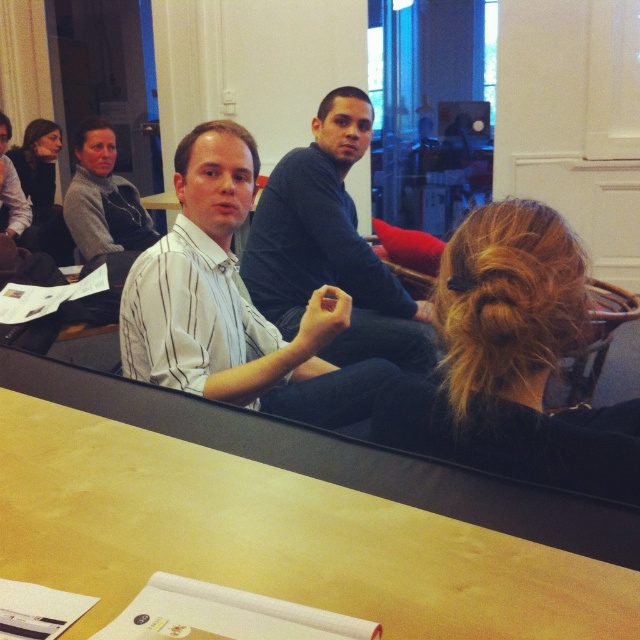
Looking at this image, does wooden table at lower center appear over white striped shirt at left?

No, wooden table at lower center is not above white striped shirt at left.

Is wooden table at lower center taller than white striped shirt at left?

No, wooden table at lower center is not taller than white striped shirt at left.

The height and width of the screenshot is (640, 640). Find the location of `wooden table at lower center`. wooden table at lower center is located at coordinates (273, 538).

Find the location of a particular element. wooden table at lower center is located at coordinates (273, 538).

Does blonde hair at center have a larger size compared to white striped shirt at center?

Actually, blonde hair at center might be smaller than white striped shirt at center.

What do you see at coordinates (512, 362) in the screenshot?
I see `blonde hair at center` at bounding box center [512, 362].

The width and height of the screenshot is (640, 640). What are the coordinates of `blonde hair at center` in the screenshot? It's located at (512, 362).

Is blonde hair at center to the left of dark blue sweater at center from the viewer's perspective?

No, blonde hair at center is not to the left of dark blue sweater at center.

What do you see at coordinates (512, 362) in the screenshot? I see `blonde hair at center` at bounding box center [512, 362].

At what (x,y) coordinates should I click in order to perform the action: click on blonde hair at center. Please return your answer as a coordinate pair (x, y). Looking at the image, I should click on (512, 362).